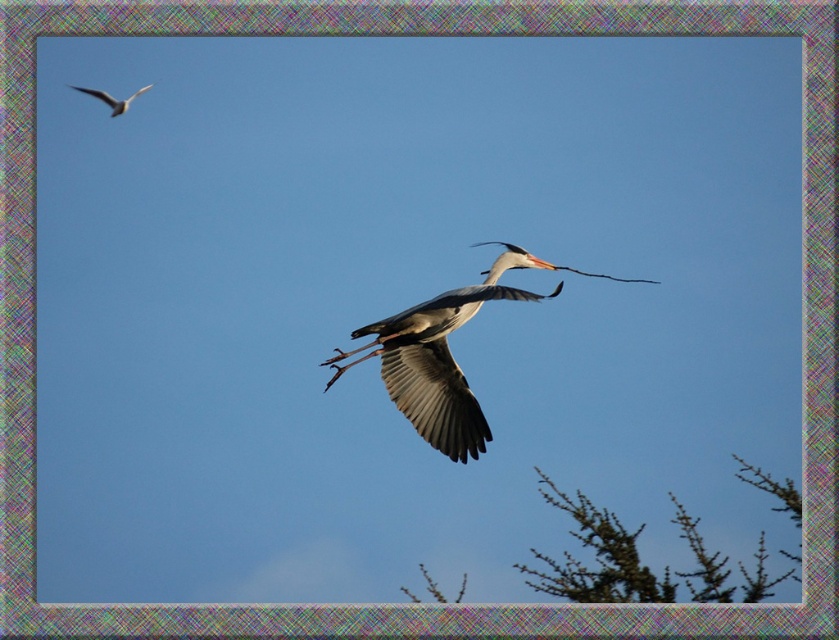
Can you confirm if green textured branches at lower right is positioned to the right of gray matte bird at center?

Correct, you'll find green textured branches at lower right to the right of gray matte bird at center.

The width and height of the screenshot is (839, 640). What do you see at coordinates (595, 557) in the screenshot?
I see `green textured branches at lower right` at bounding box center [595, 557].

What are the coordinates of `green textured branches at lower right` in the screenshot? It's located at (595, 557).

Does green textured branches at lower right appear under white glossy bird at upper left?

Yes, green textured branches at lower right is below white glossy bird at upper left.

Which is more to the left, green textured branches at lower right or white glossy bird at upper left?

white glossy bird at upper left is more to the left.

The image size is (839, 640). Describe the element at coordinates (595, 557) in the screenshot. I see `green textured branches at lower right` at that location.

In order to click on green textured branches at lower right in this screenshot , I will do `click(595, 557)`.

Can you confirm if gray matte bird at center is wider than white glossy bird at upper left?

Correct, the width of gray matte bird at center exceeds that of white glossy bird at upper left.

Describe the element at coordinates (441, 356) in the screenshot. The height and width of the screenshot is (640, 839). I see `gray matte bird at center` at that location.

Find the location of `gray matte bird at center`. gray matte bird at center is located at coordinates (441, 356).